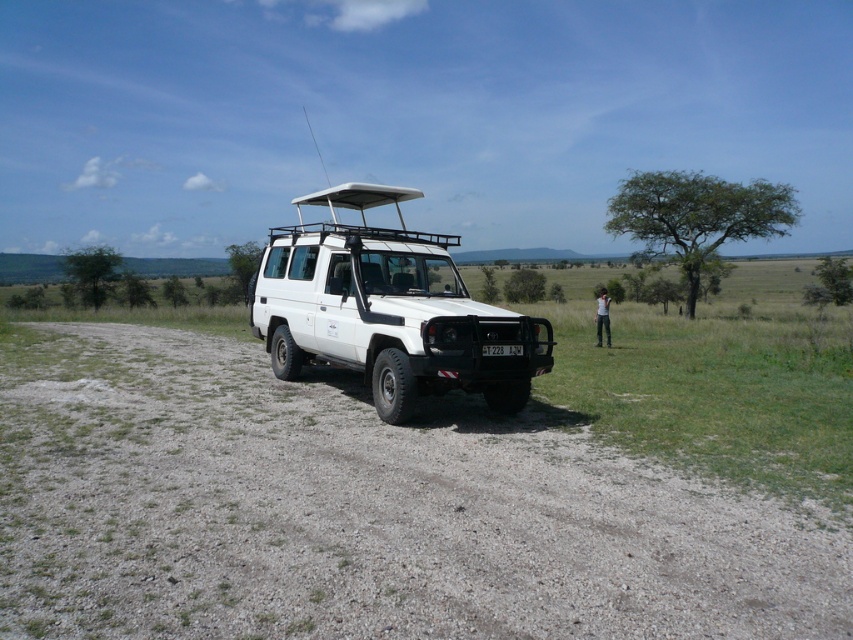
Is white matte jeep at center in front of black plastic license plate at center?

Yes, white matte jeep at center is in front of black plastic license plate at center.

Which is below, white matte jeep at center or black plastic license plate at center?

black plastic license plate at center is lower down.

Locate an element on the screen. The height and width of the screenshot is (640, 853). white matte jeep at center is located at coordinates [x=386, y=308].

Between dirt/gravel road at lower left and white matte jeep at center, which one appears on the left side from the viewer's perspective?

From the viewer's perspective, white matte jeep at center appears more on the left side.

Between point (236, 506) and point (434, 352), which one is positioned in front?

Point (236, 506) is more forward.

The height and width of the screenshot is (640, 853). I want to click on dirt/gravel road at lower left, so click(358, 512).

Does point (538, 488) come in front of point (517, 346)?

Yes, point (538, 488) is in front of point (517, 346).

Who is positioned more to the left, dirt/gravel road at lower left or black plastic license plate at center?

dirt/gravel road at lower left

Does point (842, 588) come behind point (492, 353)?

That is False.

Where is `dirt/gravel road at lower left`? This screenshot has width=853, height=640. dirt/gravel road at lower left is located at coordinates (358, 512).